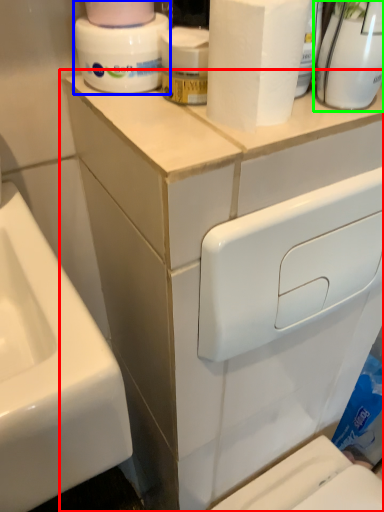
Question: Based on their relative distances, which object is farther from bathroom cabinet (highlighted by a red box)? Choose from cleaning product (highlighted by a blue box) and cleaning product (highlighted by a green box).

Choices:
 (A) cleaning product
 (B) cleaning product

Answer: (B)